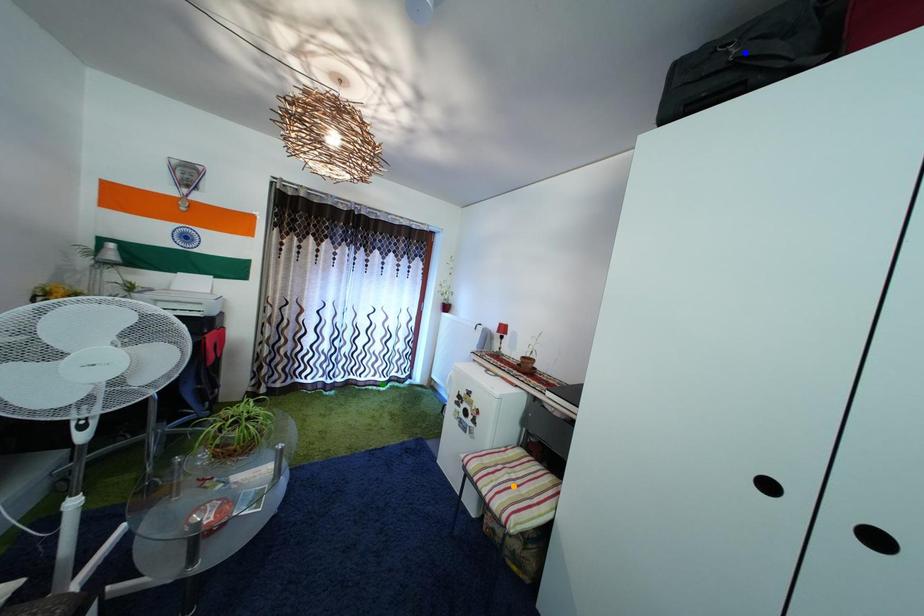
Order these from nearest to farthest:
1. green point
2. blue point
3. orange point

green point, orange point, blue point